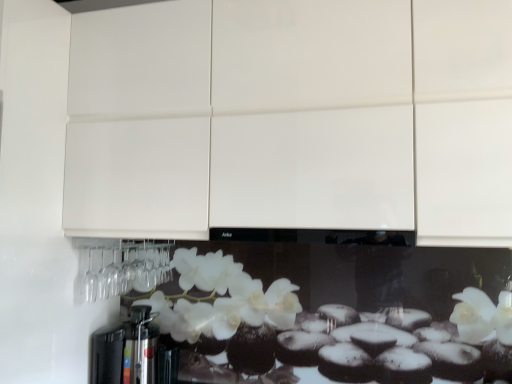
Find the location of a particular element. Image resolution: width=512 pixels, height=384 pixels. white glossy cabinet at upper center is located at coordinates (292, 119).

What do you see at coordinates (292, 119) in the screenshot? The image size is (512, 384). I see `white glossy cabinet at upper center` at bounding box center [292, 119].

Measure the distance between white glossy cabinet at upper center and camera.

white glossy cabinet at upper center and camera are 1.09 meters apart.

Identify the location of metallic silver coffee machine at lower left. The height and width of the screenshot is (384, 512). (133, 352).

The image size is (512, 384). What do you see at coordinates (133, 352) in the screenshot?
I see `metallic silver coffee machine at lower left` at bounding box center [133, 352].

Find the location of a particular element. white glossy cabinet at upper center is located at coordinates (292, 119).

Is metallic silver coffee machine at lower left to the right of white glossy cabinet at upper center from the viewer's perspective?

No, metallic silver coffee machine at lower left is not to the right of white glossy cabinet at upper center.

Is metallic silver coffee machine at lower left behind white glossy cabinet at upper center?

Yes, metallic silver coffee machine at lower left is further from the camera.

Which is less distant, (125, 376) or (495, 186)?

Clearly, point (125, 376) is more distant from the camera than point (495, 186).

From the image's perspective, would you say metallic silver coffee machine at lower left is positioned over white glossy cabinet at upper center?

No, from the image's perspective, metallic silver coffee machine at lower left is not over white glossy cabinet at upper center.

From a real-world perspective, which is physically below, metallic silver coffee machine at lower left or white glossy cabinet at upper center?

metallic silver coffee machine at lower left is physically lower.

Does metallic silver coffee machine at lower left have a greater width compared to white glossy cabinet at upper center?

No.

Who is shorter, metallic silver coffee machine at lower left or white glossy cabinet at upper center?

metallic silver coffee machine at lower left is shorter.

Between metallic silver coffee machine at lower left and white glossy cabinet at upper center, which one has smaller size?

With smaller size is metallic silver coffee machine at lower left.

Is metallic silver coffee machine at lower left positioned beyond the bounds of white glossy cabinet at upper center?

Yes, metallic silver coffee machine at lower left is not within white glossy cabinet at upper center.

Does metallic silver coffee machine at lower left touch white glossy cabinet at upper center?

No, metallic silver coffee machine at lower left is not with white glossy cabinet at upper center.

Is metallic silver coffee machine at lower left looking in the opposite direction of white glossy cabinet at upper center?

metallic silver coffee machine at lower left does not have its back to white glossy cabinet at upper center.

What's the angular difference between metallic silver coffee machine at lower left and white glossy cabinet at upper center's facing directions?

metallic silver coffee machine at lower left and white glossy cabinet at upper center are facing 1.18 degrees away from each other.

Where is `cabinetry that is on the right side of metallic silver coffee machine at lower left`? The width and height of the screenshot is (512, 384). cabinetry that is on the right side of metallic silver coffee machine at lower left is located at coordinates (292, 119).

Which object is positioned more to the right, white glossy cabinet at upper center or metallic silver coffee machine at lower left?

From the viewer's perspective, white glossy cabinet at upper center appears more on the right side.

Which object is more forward, white glossy cabinet at upper center or metallic silver coffee machine at lower left?

white glossy cabinet at upper center is more forward.

Which point is more forward, (x=306, y=128) or (x=145, y=334)?

The point (x=306, y=128) is closer to the camera.

From the image's perspective, is white glossy cabinet at upper center located beneath metallic silver coffee machine at lower left?

No, from the image's perspective, white glossy cabinet at upper center is not beneath metallic silver coffee machine at lower left.

From a real-world perspective, is white glossy cabinet at upper center positioned under metallic silver coffee machine at lower left based on gravity?

Incorrect, from a real-world perspective, white glossy cabinet at upper center is higher than metallic silver coffee machine at lower left.

Considering the sizes of white glossy cabinet at upper center and metallic silver coffee machine at lower left in the image, is white glossy cabinet at upper center wider or thinner than metallic silver coffee machine at lower left?

Clearly, white glossy cabinet at upper center has more width compared to metallic silver coffee machine at lower left.

Does white glossy cabinet at upper center have a greater height compared to metallic silver coffee machine at lower left?

Yes.

Is white glossy cabinet at upper center smaller than metallic silver coffee machine at lower left?

No, white glossy cabinet at upper center is not smaller than metallic silver coffee machine at lower left.

Is white glossy cabinet at upper center surrounding metallic silver coffee machine at lower left?

No, metallic silver coffee machine at lower left is not surrounded by white glossy cabinet at upper center.

Are white glossy cabinet at upper center and metallic silver coffee machine at lower left located far from each other?

No.

Is white glossy cabinet at upper center aimed at metallic silver coffee machine at lower left?

No, white glossy cabinet at upper center is not oriented towards metallic silver coffee machine at lower left.

How much distance is there between white glossy cabinet at upper center and metallic silver coffee machine at lower left?

A distance of 31.68 inches exists between white glossy cabinet at upper center and metallic silver coffee machine at lower left.

This screenshot has width=512, height=384. Identify the location of coffee machine that appears behind the white glossy cabinet at upper center. (133, 352).

Locate an element on the screen. coffee machine behind the white glossy cabinet at upper center is located at coordinates (133, 352).

This screenshot has height=384, width=512. I want to click on coffee machine below the white glossy cabinet at upper center (from a real-world perspective), so coord(133,352).